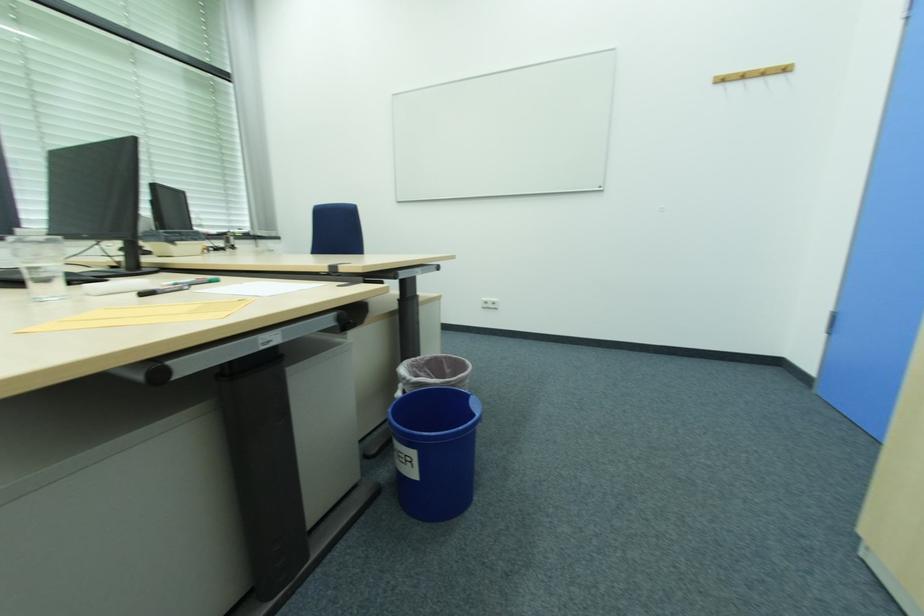
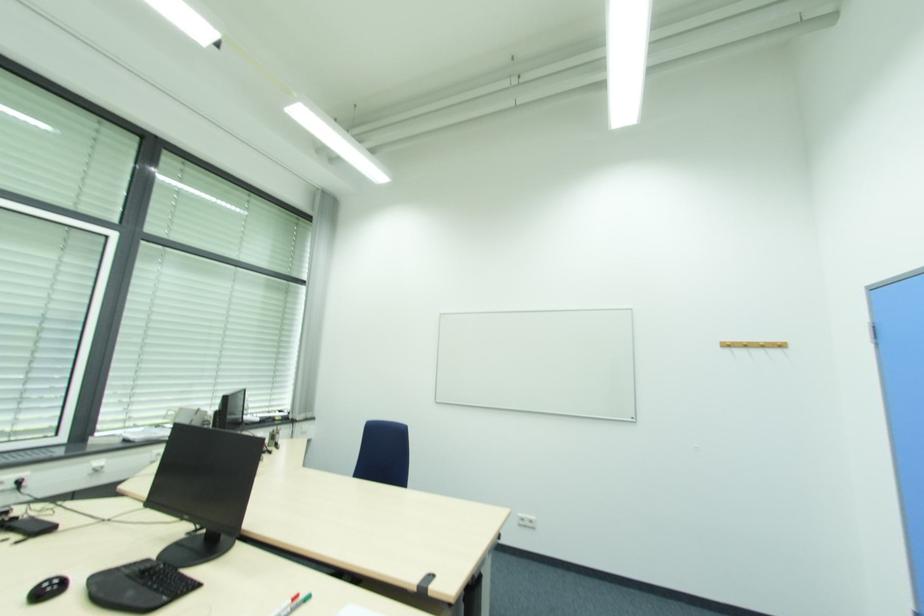
The point at (496, 304) is marked in the first image. Where is the corresponding point in the second image?

(533, 524)